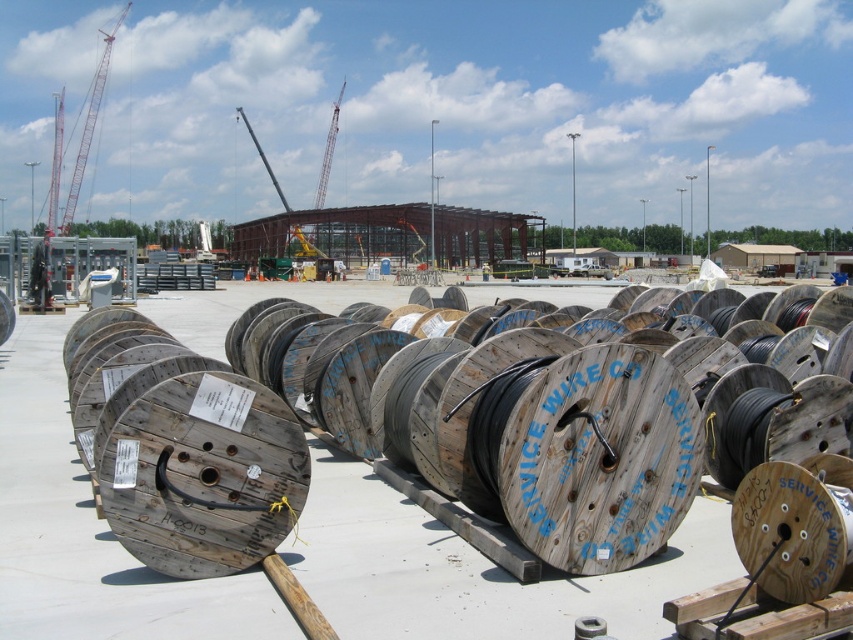
Does point (643, 349) come behind point (428, 499)?

No, it is in front of (428, 499).

Is wooden spool at center to the left of wooden spools of wire at center from the viewer's perspective?

No, wooden spool at center is not to the left of wooden spools of wire at center.

Locate an element on the screen. wooden spool at center is located at coordinates (601, 458).

Locate an element on the screen. The width and height of the screenshot is (853, 640). wooden spool at center is located at coordinates (601, 458).

Who is more forward, (477,525) or (65,218)?

Point (477,525)

How much distance is there between wooden spools of wire at center and red metal crane at upper left?

wooden spools of wire at center is 72.72 meters from red metal crane at upper left.

Which is behind, point (402, 486) or point (68, 220)?

Point (68, 220)

The height and width of the screenshot is (640, 853). I want to click on wooden spools of wire at center, so click(451, 516).

Can you confirm if wooden spool at center is positioned above red metal crane at upper left?

No, wooden spool at center is not above red metal crane at upper left.

Does wooden spool at center have a greater width compared to red metal crane at upper left?

Incorrect, wooden spool at center's width does not surpass red metal crane at upper left's.

Measure the distance between wooden spool at center and camera.

The distance of wooden spool at center from camera is 4.64 meters.

In order to click on wooden spool at center in this screenshot , I will do `click(601, 458)`.